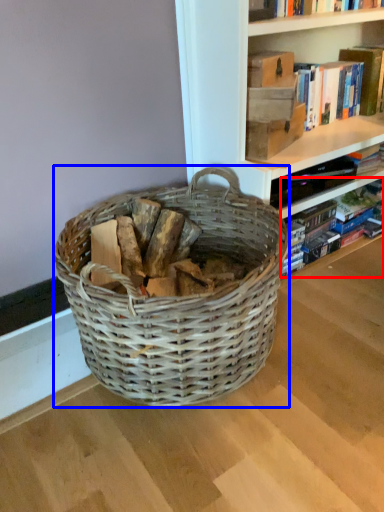
Question: Which of the following is the closest to the observer, book (highlighted by a red box) or picnic basket (highlighted by a blue box)?

Choices:
 (A) book
 (B) picnic basket

Answer: (B)